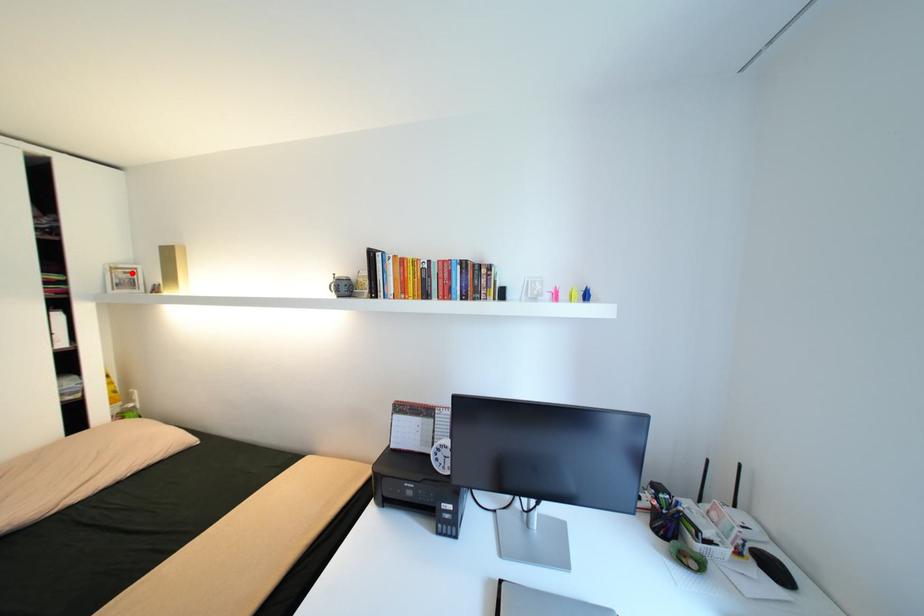
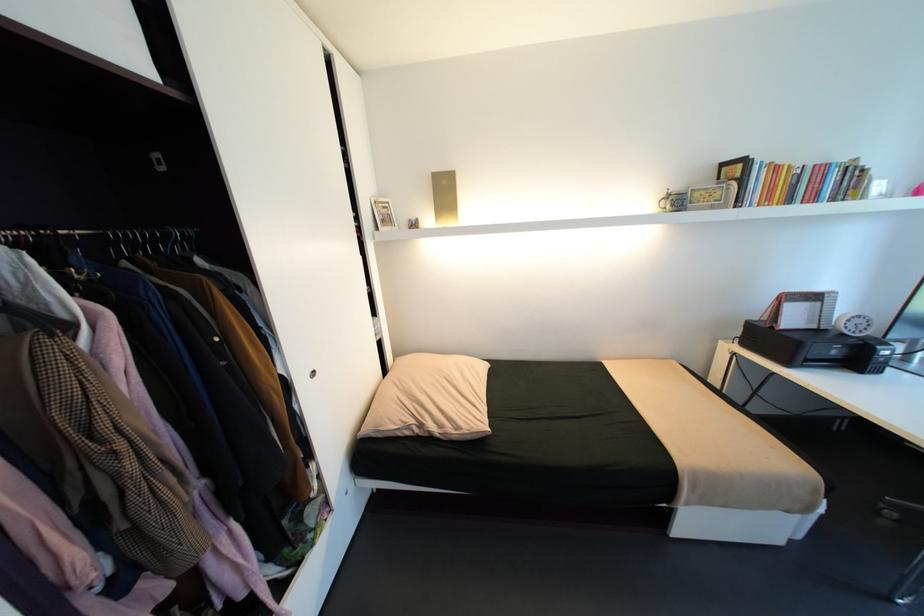
Where in the second image is the point corresponding to the highlighted location from the first image?

(392, 208)